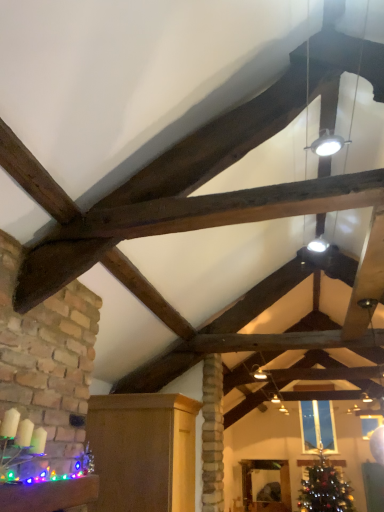
In order to click on clear glass window at center in this screenshot , I will do `click(317, 425)`.

The image size is (384, 512). What do you see at coordinates (280, 484) in the screenshot?
I see `wooden mirror at center, the 1th furniture positioned from the back` at bounding box center [280, 484].

How much space does wooden mirror at center, which ranks as the third furniture in left-to-right order, occupy horizontally?

wooden mirror at center, which ranks as the third furniture in left-to-right order, is 0.81 inches wide.

What do you see at coordinates (324, 488) in the screenshot?
I see `shiny green christmas tree at lower right` at bounding box center [324, 488].

Where is `multicolored plastic garland at lower left, acting as the 1th furniture starting from the left`? This screenshot has height=512, width=384. multicolored plastic garland at lower left, acting as the 1th furniture starting from the left is located at coordinates click(x=49, y=495).

How far apart are multicolored plastic garland at lower left, which is the third furniture from back to front, and wooden mirror at center, which ranks as the third furniture in left-to-right order?

8.41 feet.

Who is taller, multicolored plastic garland at lower left, acting as the 1th furniture starting from the left, or wooden mirror at center, the 1th furniture positioned from the back?

wooden mirror at center, the 1th furniture positioned from the back, is taller.

Is wooden mirror at center, which ranks as the third furniture in left-to-right order, a part of multicolored plastic garland at lower left, which is counted as the 3th furniture, starting from the right?

No, wooden mirror at center, which ranks as the third furniture in left-to-right order, is not a part of multicolored plastic garland at lower left, which is counted as the 3th furniture, starting from the right.

Is multicolored plastic garland at lower left, acting as the 1th furniture starting from the left, to the right of wooden mirror at center, which ranks as the third furniture in left-to-right order, from the viewer's perspective?

No, multicolored plastic garland at lower left, acting as the 1th furniture starting from the left, is not to the right of wooden mirror at center, which ranks as the third furniture in left-to-right order.

Considering the positions of point (284, 470) and point (334, 483), is point (284, 470) closer or farther from the camera than point (334, 483)?

Point (284, 470) is positioned farther from the camera compared to point (334, 483).

From the image's perspective, is wooden mirror at center, which ranks as the third furniture in left-to-right order, located beneath shiny green christmas tree at lower right?

Yes, from the image's perspective, wooden mirror at center, which ranks as the third furniture in left-to-right order, is below shiny green christmas tree at lower right.

Could you tell me if wooden mirror at center, which appears as the 1th furniture when viewed from the right, is facing shiny green christmas tree at lower right?

No, wooden mirror at center, which appears as the 1th furniture when viewed from the right, is not facing towards shiny green christmas tree at lower right.

Is wooden mirror at center, the 1th furniture positioned from the back, not inside shiny green christmas tree at lower right?

Indeed, wooden mirror at center, the 1th furniture positioned from the back, is completely outside shiny green christmas tree at lower right.

Is clear glass window at center to the left of wooden mirror at center, which ranks as the third furniture in left-to-right order, from the viewer's perspective?

No.

Is clear glass window at center oriented towards wooden mirror at center, the 1th furniture positioned from the back?

No.

Which is closer to the camera, (304, 402) or (285, 473)?

The point (304, 402) is closer.

Are clear glass window at center and wooden mirror at center, the third furniture when ordered from top to bottom, far apart?

clear glass window at center is actually quite close to wooden mirror at center, the third furniture when ordered from top to bottom.

Which of these two, wooden mirror at center, the 1th furniture positioned from the back, or clear glass window at center, stands taller?

wooden mirror at center, the 1th furniture positioned from the back.

Which is more distant, [257,464] or [310,408]?

The point [257,464] is farther.

Considering the sizes of objects wooden mirror at center, the 1th furniture positioned from the back, and clear glass window at center in the image provided, who is bigger, wooden mirror at center, the 1th furniture positioned from the back, or clear glass window at center?

clear glass window at center is bigger.

Does wooden mirror at center, acting as the first furniture starting from the bottom, appear on the left side of clear glass window at center?

Correct, you'll find wooden mirror at center, acting as the first furniture starting from the bottom, to the left of clear glass window at center.

Does multicolored plastic garland at lower left, arranged as the first furniture when viewed from the front, come in front of clear glass window at center?

Yes, it is in front of clear glass window at center.

How many degrees apart are the facing directions of multicolored plastic garland at lower left, which is counted as the 3th furniture, starting from the bottom, and clear glass window at center?

There is a 91.1-degree angle between the facing directions of multicolored plastic garland at lower left, which is counted as the 3th furniture, starting from the bottom, and clear glass window at center.

Looking at the image, does multicolored plastic garland at lower left, which is counted as the 3th furniture, starting from the right, seem bigger or smaller compared to clear glass window at center?

Considering their sizes, multicolored plastic garland at lower left, which is counted as the 3th furniture, starting from the right, takes up less space than clear glass window at center.

Is multicolored plastic garland at lower left, acting as the 1th furniture starting from the left, placed right next to clear glass window at center?

multicolored plastic garland at lower left, acting as the 1th furniture starting from the left, and clear glass window at center are not in contact.

Is multicolored plastic garland at lower left, arranged as the first furniture when viewed from the front, facing away from matte wood cabinet at lower left, arranged as the second furniture when viewed from the back?

multicolored plastic garland at lower left, arranged as the first furniture when viewed from the front, is not turned away from matte wood cabinet at lower left, arranged as the second furniture when viewed from the back.

From the image's perspective, is multicolored plastic garland at lower left, arranged as the first furniture when viewed from the top, located above or below matte wood cabinet at lower left, the 2th furniture when ordered from right to left?

Clearly, from the image's perspective, multicolored plastic garland at lower left, arranged as the first furniture when viewed from the top, is above matte wood cabinet at lower left, the 2th furniture when ordered from right to left.

Is multicolored plastic garland at lower left, acting as the 1th furniture starting from the left, to the right of matte wood cabinet at lower left, arranged as the second furniture when viewed from the back, from the viewer's perspective?

No, multicolored plastic garland at lower left, acting as the 1th furniture starting from the left, is not to the right of matte wood cabinet at lower left, arranged as the second furniture when viewed from the back.

Is point (65, 506) more distant than point (194, 434)?

No.

In the scene shown: How much distance is there between matte wood cabinet at lower left, which is the 2th furniture from top to bottom, and clear glass window at center?

matte wood cabinet at lower left, which is the 2th furniture from top to bottom, and clear glass window at center are 5.27 feet apart from each other.

Does matte wood cabinet at lower left, which is the 2th furniture from top to bottom, appear on the left side of clear glass window at center?

Yes, matte wood cabinet at lower left, which is the 2th furniture from top to bottom, is to the left of clear glass window at center.

From the image's perspective, is matte wood cabinet at lower left, arranged as the second furniture when viewed from the back, under clear glass window at center?

No, from the image's perspective, matte wood cabinet at lower left, arranged as the second furniture when viewed from the back, is not beneath clear glass window at center.

Where is `the 2nd furniture below the multicolored plastic garland at lower left, acting as the 1th furniture starting from the left (from the image's perspective)`? The image size is (384, 512). the 2nd furniture below the multicolored plastic garland at lower left, acting as the 1th furniture starting from the left (from the image's perspective) is located at coordinates (280, 484).

The height and width of the screenshot is (512, 384). In order to click on furniture located behind the shiny green christmas tree at lower right in this screenshot , I will do `click(280, 484)`.

In the scene shown: When comparing their distances from matte wood cabinet at lower left, the 2th furniture when ordered from right to left, does wooden mirror at center, positioned as the third furniture in front-to-back order, or shiny green christmas tree at lower right seem further?

shiny green christmas tree at lower right lies further to matte wood cabinet at lower left, the 2th furniture when ordered from right to left, than the other object.

Based on their spatial positions, is matte wood cabinet at lower left, the 2th furniture when ordered from right to left, or wooden mirror at center, positioned as the third furniture in front-to-back order, further from clear glass window at center?

matte wood cabinet at lower left, the 2th furniture when ordered from right to left, lies further to clear glass window at center than the other object.

Looking at the image, which one is located closer to shiny green christmas tree at lower right, multicolored plastic garland at lower left, which is counted as the 3th furniture, starting from the bottom, or clear glass window at center?

clear glass window at center is positioned closer to the anchor shiny green christmas tree at lower right.

Considering their positions, is clear glass window at center positioned further to shiny green christmas tree at lower right than wooden mirror at center, the 1th furniture positioned from the back?

wooden mirror at center, the 1th furniture positioned from the back.

Which object lies further to the anchor point wooden mirror at center, which ranks as the third furniture in left-to-right order, matte wood cabinet at lower left, arranged as the second furniture when viewed from the back, or shiny green christmas tree at lower right?

Based on the image, matte wood cabinet at lower left, arranged as the second furniture when viewed from the back, appears to be further to wooden mirror at center, which ranks as the third furniture in left-to-right order.

Considering their positions, is shiny green christmas tree at lower right positioned further to wooden mirror at center, the third furniture when ordered from top to bottom, than matte wood cabinet at lower left, the 2th furniture when ordered from right to left?

matte wood cabinet at lower left, the 2th furniture when ordered from right to left, lies further to wooden mirror at center, the third furniture when ordered from top to bottom, than the other object.

Looking at the image, which one is located further to clear glass window at center, matte wood cabinet at lower left, the 2th furniture in the left-to-right sequence, or multicolored plastic garland at lower left, which is counted as the 3th furniture, starting from the bottom?

multicolored plastic garland at lower left, which is counted as the 3th furniture, starting from the bottom, is positioned further to the anchor clear glass window at center.

Looking at the image, which one is located further to clear glass window at center, shiny green christmas tree at lower right or wooden mirror at center, which appears as the 1th furniture when viewed from the right?

wooden mirror at center, which appears as the 1th furniture when viewed from the right, is further to clear glass window at center.

This screenshot has height=512, width=384. In order to click on christmas tree between multicolored plastic garland at lower left, which is the third furniture from back to front, and wooden mirror at center, positioned as the third furniture in front-to-back order, along the z-axis in this screenshot , I will do `click(324, 488)`.

This screenshot has width=384, height=512. Find the location of `furniture between multicolored plastic garland at lower left, acting as the 1th furniture starting from the left, and shiny green christmas tree at lower right from front to back`. furniture between multicolored plastic garland at lower left, acting as the 1th furniture starting from the left, and shiny green christmas tree at lower right from front to back is located at coordinates (143, 451).

Identify the location of christmas tree located between matte wood cabinet at lower left, which is the 2th furniture in front-to-back order, and wooden mirror at center, acting as the first furniture starting from the bottom, in the depth direction. (324, 488).

Find the location of a particular element. The image size is (384, 512). furniture between shiny green christmas tree at lower right and clear glass window at center from front to back is located at coordinates (280, 484).